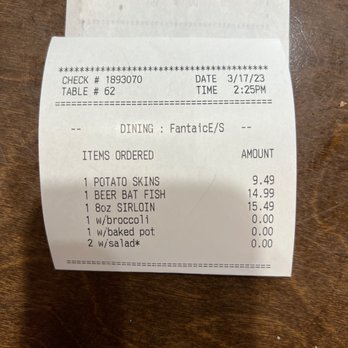
At what (x,y) coordinates should I click in order to perform the action: click on table. Please return your answer as a coordinate pair (x, y). Looking at the image, I should click on (160, 310).